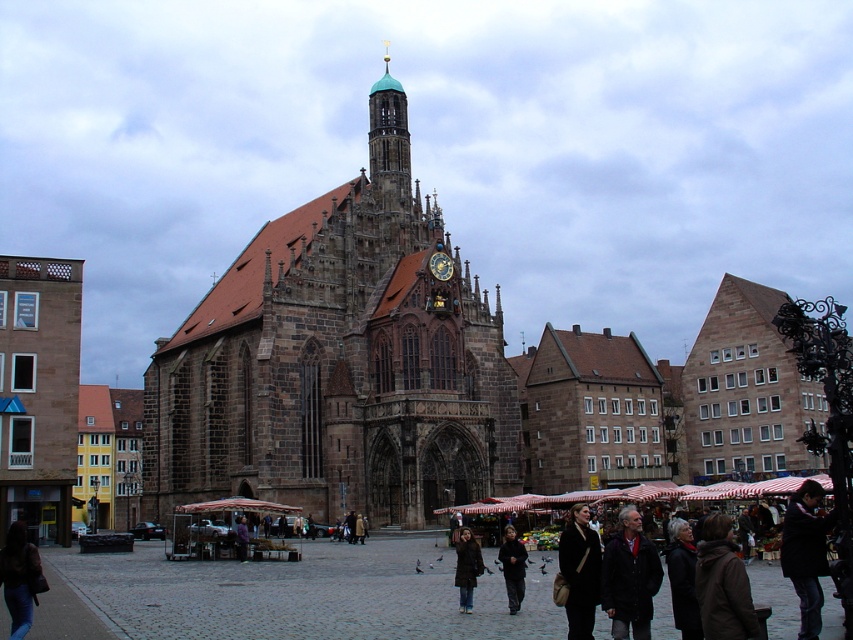
Between dark gray fabric jacket at lower right and dark brown leather jacket at center, which one has more height?

Standing taller between the two is dark gray fabric jacket at lower right.

Does dark gray fabric jacket at lower right have a smaller size compared to dark brown leather jacket at center?

No.

Is point (808, 600) farther from camera compared to point (509, 604)?

No, (808, 600) is in front of (509, 604).

The height and width of the screenshot is (640, 853). I want to click on dark gray fabric jacket at lower right, so click(805, 554).

What do you see at coordinates (775, 596) in the screenshot?
I see `dark brown leather jackets at lower right` at bounding box center [775, 596].

Can you confirm if dark brown leather jackets at lower right is taller than brown leather jacket at lower right?

Yes.

At what (x,y) coordinates should I click in order to perform the action: click on dark brown leather jackets at lower right. Please return your answer as a coordinate pair (x, y). Looking at the image, I should click on (775, 596).

Locate an element on the screen. This screenshot has width=853, height=640. dark brown leather jackets at lower right is located at coordinates (775, 596).

What do you see at coordinates (630, 577) in the screenshot? I see `dark gray jacket at lower right` at bounding box center [630, 577].

Which of these two, dark gray jacket at lower right or dark brown leather jacket at lower right, stands shorter?

With less height is dark brown leather jacket at lower right.

Does point (605, 572) come behind point (686, 605)?

Yes, it is behind point (686, 605).

Find the location of a particular element. The image size is (853, 640). dark gray jacket at lower right is located at coordinates (630, 577).